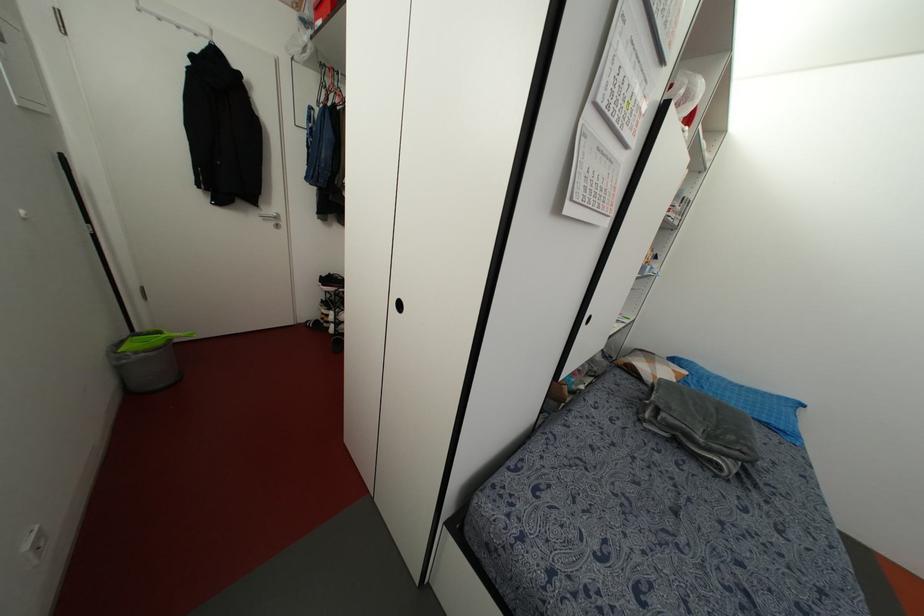
Find where to pull the black cabinet handle. Please return your answer as a coordinate pair (x, y).

(398, 305)